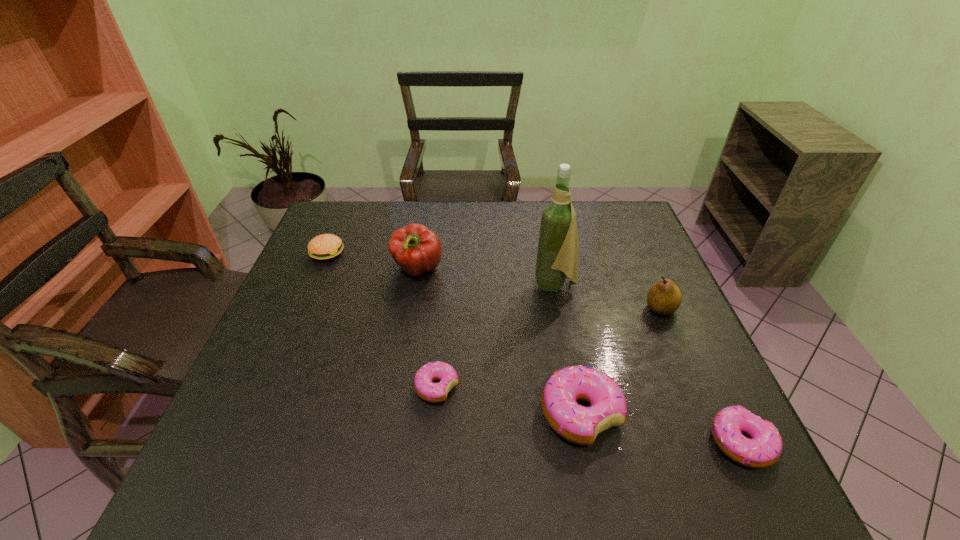
You are a GUI agent. You are given a task and a screenshot of the screen. Output one action in this format:
    pyautogui.click(x=<x>, y=<y>)
    Task: Click on the shortest doughnut
    The height and width of the screenshot is (540, 960).
    Given the screenshot: What is the action you would take?
    pyautogui.click(x=423, y=384)

At what (x,y) coordinates should I click in order to perform the action: click on the leftmost doughnut. Please return your answer as a coordinate pair (x, y). The height and width of the screenshot is (540, 960). Looking at the image, I should click on click(423, 384).

Image resolution: width=960 pixels, height=540 pixels. What are the coordinates of `the fourth tallest object` in the screenshot? It's located at 577,424.

The image size is (960, 540). Find the location of `the tallest doughnut`. the tallest doughnut is located at coordinates (577, 424).

This screenshot has width=960, height=540. Identify the location of the rightmost doughnut. (764, 448).

The image size is (960, 540). In order to click on the tallest object in this screenshot , I will do `click(557, 252)`.

At what (x,y) coordinates should I click in order to perform the action: click on the sixth shortest object. Please return your answer as a coordinate pair (x, y). Looking at the image, I should click on (416, 249).

At what (x,y) coordinates should I click in order to perform the action: click on pear. Please return your answer as a coordinate pair (x, y). Looking at the image, I should click on (664, 297).

Where is `patty`? patty is located at coordinates (326, 246).

This screenshot has height=540, width=960. Identify the location of free point located on the back of the shortest doughnut. (443, 327).